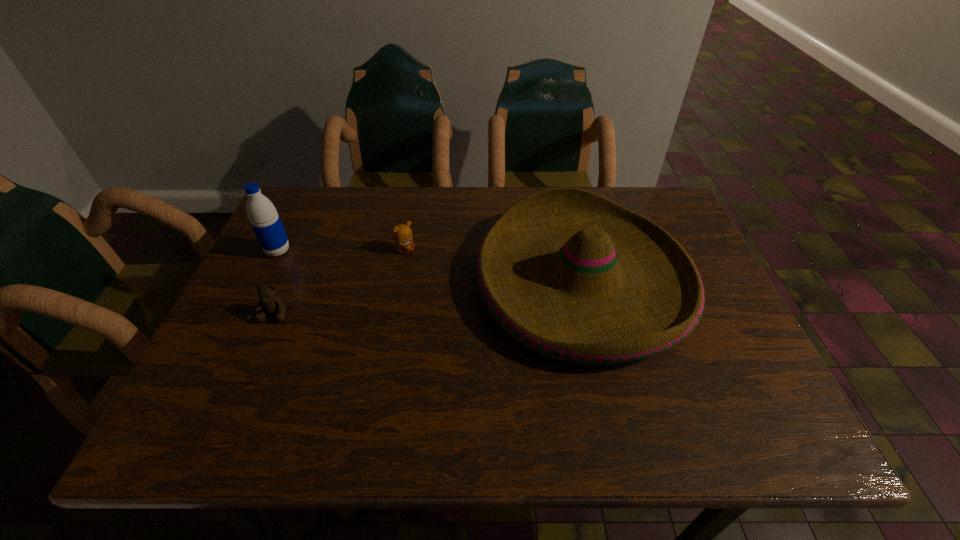
This screenshot has width=960, height=540. In order to click on object situated at the far edge in this screenshot , I will do `click(570, 274)`.

Locate an element on the screen. Image resolution: width=960 pixels, height=540 pixels. water bottle that is at the left edge is located at coordinates (265, 221).

This screenshot has width=960, height=540. What are the coordinates of `teddy bear at the left edge` in the screenshot? It's located at (272, 305).

At what (x,y) coordinates should I click in order to perform the action: click on object located in the right edge section of the desktop. Please return your answer as a coordinate pair (x, y). The height and width of the screenshot is (540, 960). Looking at the image, I should click on (570, 274).

The width and height of the screenshot is (960, 540). In order to click on object that is at the far right corner in this screenshot , I will do `click(570, 274)`.

This screenshot has height=540, width=960. I want to click on free region at the far edge of the desktop, so [x=423, y=197].

Locate an element on the screen. The width and height of the screenshot is (960, 540). vacant space at the near edge of the desktop is located at coordinates (564, 409).

The image size is (960, 540). In order to click on free space at the left edge of the desktop in this screenshot , I will do `click(284, 325)`.

Where is `vacant space at the right edge of the desktop`? The width and height of the screenshot is (960, 540). vacant space at the right edge of the desktop is located at coordinates (742, 353).

Where is `free space at the far right corner of the desktop`? This screenshot has width=960, height=540. free space at the far right corner of the desktop is located at coordinates (638, 190).